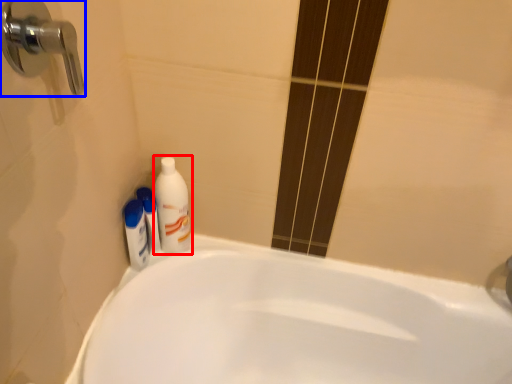
Question: Among these objects, which one is farthest to the camera, cleaning product (highlighted by a red box) or door handle (highlighted by a blue box)?

Choices:
 (A) cleaning product
 (B) door handle

Answer: (A)